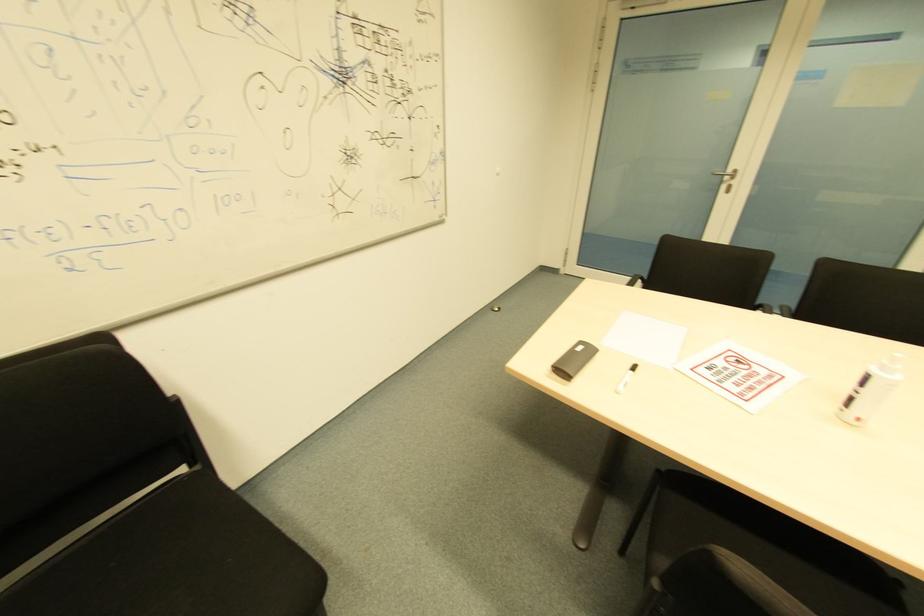
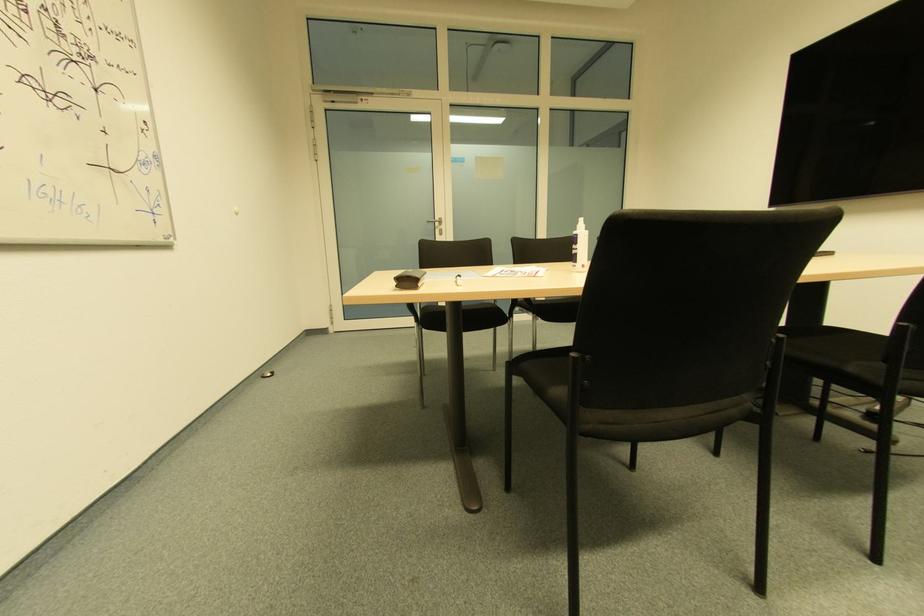
Locate, in the second image, the point that corresponds to point 732,184 in the first image.

(440, 230)